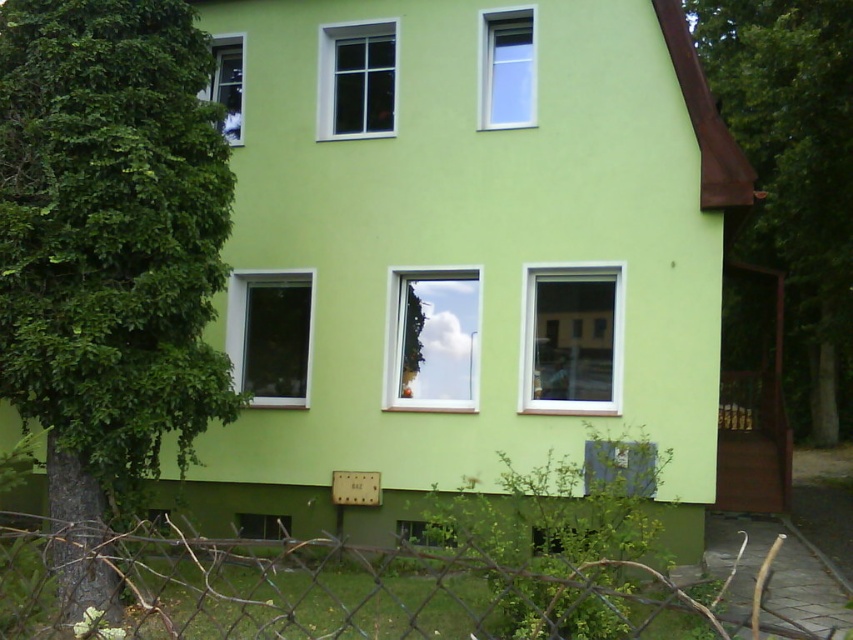
Question: Is transparent glass window at center to the right of transparent glass window at upper left from the viewer's perspective?

Choices:
 (A) yes
 (B) no

Answer: (A)

Question: Among these objects, which one is nearest to the camera?

Choices:
 (A) clear glass window at center right
 (B) white glass window at upper center
 (C) green leafy tree at right
 (D) green leafy tree at left

Answer: (D)

Question: Estimate the real-world distances between objects in this image. Which object is farther from the metal wire mesh at lower center?

Choices:
 (A) clear glass window at center
 (B) green leafy tree at right

Answer: (B)

Question: Can you confirm if green leafy tree at right is bigger than clear glass window at center right?

Choices:
 (A) no
 (B) yes

Answer: (B)

Question: Which object is the closest to the green leafy tree at left?

Choices:
 (A) clear glass window at center
 (B) clear glass window at center right

Answer: (A)

Question: Can you confirm if metal wire mesh at lower center is bigger than transparent glass window at center?

Choices:
 (A) yes
 (B) no

Answer: (B)